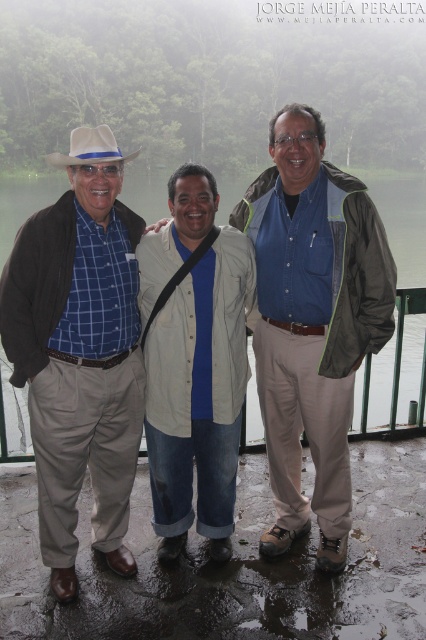
Between point (155, 504) and point (89, 148), which one is positioned in front?

Point (89, 148) is in front.

Can you confirm if beige cotton shirt at center is positioned to the right of white felt cowboy hat at upper left?

Indeed, beige cotton shirt at center is positioned on the right side of white felt cowboy hat at upper left.

Find the location of `beige cotton shirt at center`. beige cotton shirt at center is located at coordinates (198, 396).

Can you confirm if blue denim shirt at center is bigger than beige cotton shirt at center?

Yes.

Find the location of a particular element. The image size is (426, 640). blue denim shirt at center is located at coordinates [313, 321].

At what (x,y) coordinates should I click in order to perform the action: click on blue denim shirt at center. Please return your answer as a coordinate pair (x, y). Looking at the image, I should click on (313, 321).

In the scene shown: Can you confirm if blue plaid shirt at left is positioned above white felt cowboy hat at upper left?

No, blue plaid shirt at left is not above white felt cowboy hat at upper left.

Who is more forward, [20,300] or [108,156]?

Point [20,300]

Is point (106, 321) in front of point (100, 128)?

No, (106, 321) is behind (100, 128).

Find the location of a particular element. The height and width of the screenshot is (640, 426). blue plaid shirt at left is located at coordinates (80, 353).